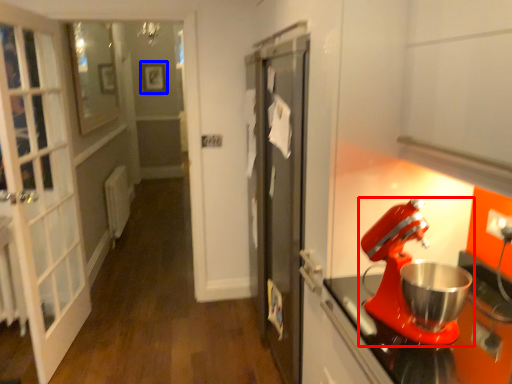
Question: Which of the following is the closest to the observer, mixer (highlighted by a red box) or picture frame (highlighted by a blue box)?

Choices:
 (A) mixer
 (B) picture frame

Answer: (A)